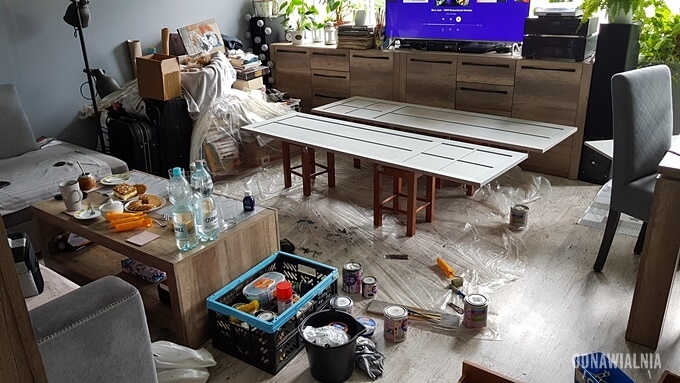
This screenshot has height=383, width=680. Find the location of `cans of paint`. cans of paint is located at coordinates (350, 279), (343, 305), (364, 287), (339, 325), (396, 328), (471, 312), (517, 211), (266, 314).